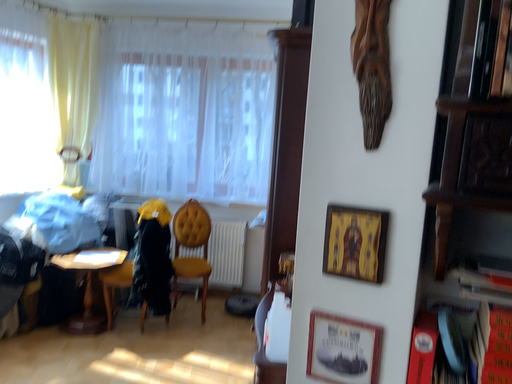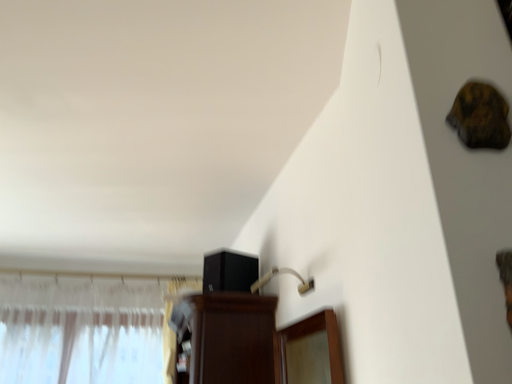
Question: How did the camera likely rotate when shooting the video?

Choices:
 (A) rotated upward
 (B) rotated downward

Answer: (A)